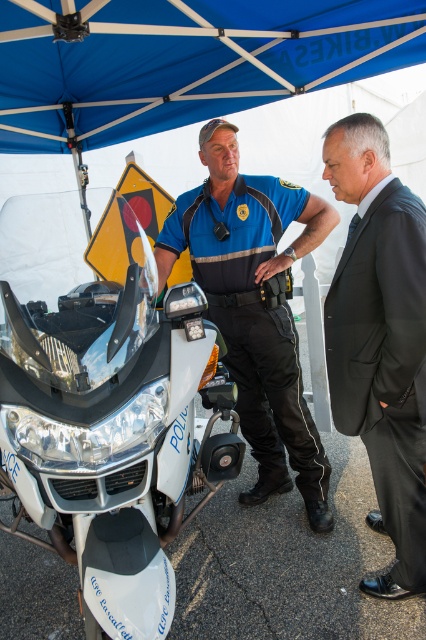
You are a delivery person trying to navigate through the parking lot. You see the white glossy motorcycle at center and the black suit at right. Which object is wider, and can you pass between them without touching either?

The white glossy motorcycle at center is wider than the black suit at right. Since the motorcycle is wider, there might not be enough space to pass between them safely. It is recommended to choose a different path to avoid collision.

You are a security guard at an outdoor event. You need to check if there is enough space between the black suit at right and the blue uniform at center for a 1 meter wide barrier. Based on the scene description, can you fit the barrier between them?

The black suit at right and blue uniform at center are 81.68 centimeters apart. Since 81.68 cm is less than 1 meter, the barrier cannot be placed between them.

In the scene shown: You are a photographer standing at the back of the scene. You want to capture both the blue fabric canopy at upper center and the black suit at right in a single shot. Which object should you frame first to ensure both are included in the photo?

You should frame the blue fabric canopy at upper center first because its width surpasses the black suit at right, making it the wider object. By centering the wider object, you can adjust the camera angle to include the narrower black suit at right within the same frame.